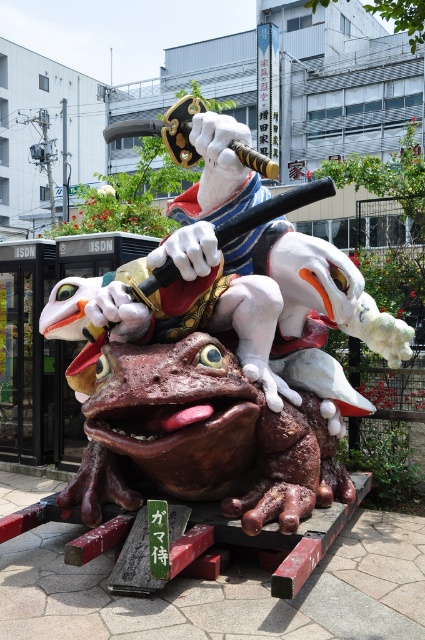
Question: Which object is closer to the camera taking this photo?

Choices:
 (A) shiny metallic statue at center
 (B) shiny white octopus at center

Answer: (B)

Question: Does shiny metallic statue at center have a larger size compared to shiny white octopus at center?

Choices:
 (A) no
 (B) yes

Answer: (B)

Question: Can you confirm if shiny metallic statue at center is smaller than shiny white octopus at center?

Choices:
 (A) no
 (B) yes

Answer: (A)

Question: Among these objects, which one is nearest to the camera?

Choices:
 (A) shiny white octopus at center
 (B) shiny metallic statue at center

Answer: (A)

Question: Can you confirm if shiny metallic statue at center is bigger than shiny white octopus at center?

Choices:
 (A) no
 (B) yes

Answer: (B)

Question: Which point is farther from the camera taking this photo?

Choices:
 (A) tap(411, 332)
 (B) tap(291, 500)

Answer: (A)